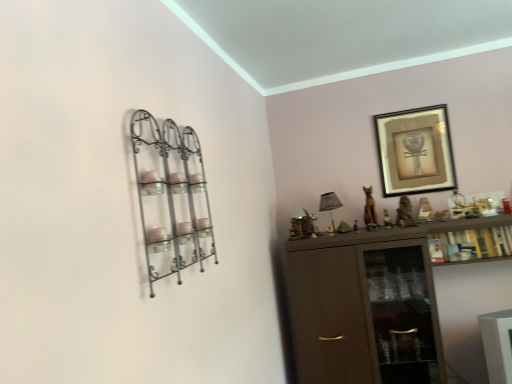
Question: Is satin gray fabric lampshade at upper center inside metallic wire shelf at left?

Choices:
 (A) yes
 (B) no

Answer: (B)

Question: Does metallic wire shelf at left have a smaller size compared to satin gray fabric lampshade at upper center?

Choices:
 (A) yes
 (B) no

Answer: (B)

Question: From a real-world perspective, is metallic wire shelf at left on satin gray fabric lampshade at upper center?

Choices:
 (A) no
 (B) yes

Answer: (B)

Question: Does metallic wire shelf at left have a lesser width compared to satin gray fabric lampshade at upper center?

Choices:
 (A) yes
 (B) no

Answer: (A)

Question: Can you confirm if metallic wire shelf at left is positioned to the left of satin gray fabric lampshade at upper center?

Choices:
 (A) yes
 (B) no

Answer: (A)

Question: Which is correct: satin gray fabric lampshade at upper center is inside gold-framed artwork at upper right, or outside of it?

Choices:
 (A) inside
 (B) outside

Answer: (B)

Question: From a real-world perspective, is satin gray fabric lampshade at upper center physically located above or below gold-framed artwork at upper right?

Choices:
 (A) above
 (B) below

Answer: (B)

Question: In terms of width, does satin gray fabric lampshade at upper center look wider or thinner when compared to gold-framed artwork at upper right?

Choices:
 (A) wide
 (B) thin

Answer: (A)

Question: Would you say satin gray fabric lampshade at upper center is to the left or to the right of gold-framed artwork at upper right in the picture?

Choices:
 (A) left
 (B) right

Answer: (A)

Question: From the image's perspective, is wooden cabinet at right positioned above or below gold-framed artwork at upper right?

Choices:
 (A) below
 (B) above

Answer: (A)

Question: Would you say wooden cabinet at right is to the left or to the right of gold-framed artwork at upper right in the picture?

Choices:
 (A) left
 (B) right

Answer: (B)

Question: In terms of width, does wooden cabinet at right look wider or thinner when compared to gold-framed artwork at upper right?

Choices:
 (A) wide
 (B) thin

Answer: (A)

Question: From a real-world perspective, is wooden cabinet at right above or below gold-framed artwork at upper right?

Choices:
 (A) below
 (B) above

Answer: (A)

Question: Is satin gray fabric lampshade at upper center spatially inside wooden cabinet at right, or outside of it?

Choices:
 (A) outside
 (B) inside

Answer: (A)

Question: From the image's perspective, is satin gray fabric lampshade at upper center above or below wooden cabinet at right?

Choices:
 (A) above
 (B) below

Answer: (A)